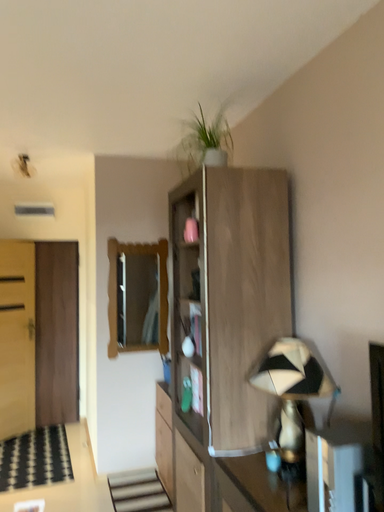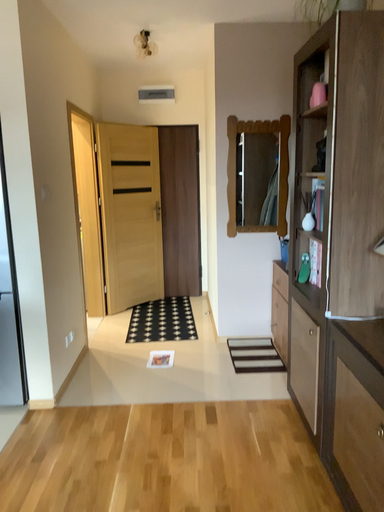
Question: How did the camera likely rotate when shooting the video?

Choices:
 (A) rotated right
 (B) rotated left

Answer: (B)